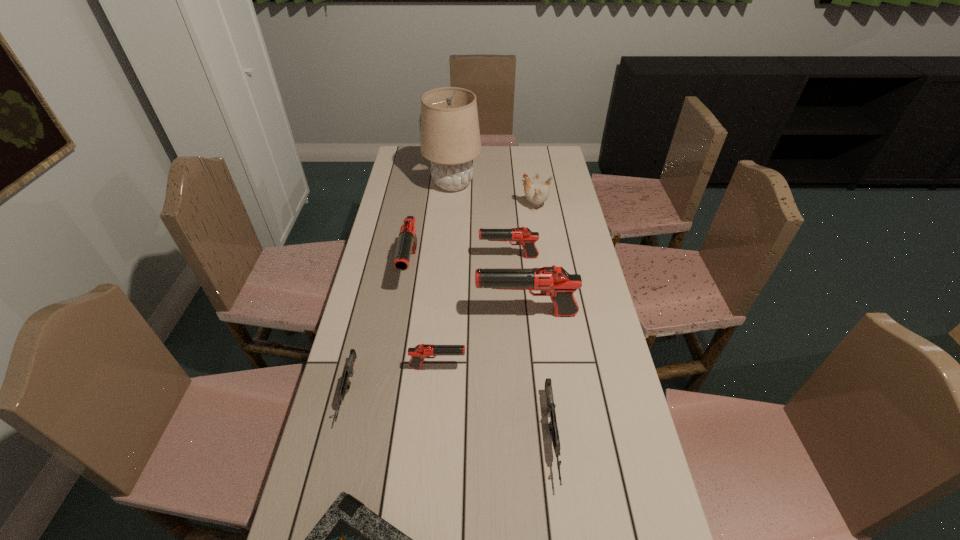
Where is `vacant space that's between the lampshade and the second biggest black gun`? The width and height of the screenshot is (960, 540). vacant space that's between the lampshade and the second biggest black gun is located at coordinates (432, 226).

This screenshot has height=540, width=960. What are the coordinates of `vacant area that lies between the tallest object and the fifth tallest gun` in the screenshot? It's located at pyautogui.click(x=502, y=311).

This screenshot has height=540, width=960. Identify the location of object that ranks as the fifth closest to the fourth gun from right to left. 349,539.

Where is `the fourth closest object to the bird`? the fourth closest object to the bird is located at coordinates (556, 282).

Locate which gun ranks fifth in proximity to the white bird. Please provide its 2D coordinates. Your answer should be formatted as a tuple, i.e. [(x, y)], where the tuple contains the x and y coordinates of a point satisfying the conditions above.

[(554, 433)]

Locate an element on the screen. The width and height of the screenshot is (960, 540). the fourth closest gun relative to the seventh tallest object is located at coordinates (523, 236).

Choose which black gun is the second nearest neighbor to the shortest object. Please provide its 2D coordinates. Your answer should be formatted as a tuple, i.e. [(x, y)], where the tuple contains the x and y coordinates of a point satisfying the conditions above.

[(556, 282)]

This screenshot has width=960, height=540. I want to click on black gun that is the nearest to the right grey gun, so click(422, 351).

Point out which grey gun is positioned as the second nearest to the white bird. Please provide its 2D coordinates. Your answer should be formatted as a tuple, i.e. [(x, y)], where the tuple contains the x and y coordinates of a point satisfying the conditions above.

[(345, 384)]

Find the location of a particular element. The image size is (960, 540). the closest grey gun to the fifth gun from right to left is located at coordinates (345, 384).